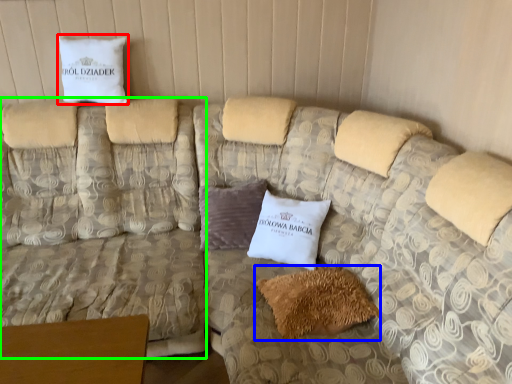
Question: Which object is positioned farthest from pillow (highlighted by a red box)? Select from pillow (highlighted by a blue box) and couch (highlighted by a green box).

Choices:
 (A) pillow
 (B) couch

Answer: (A)